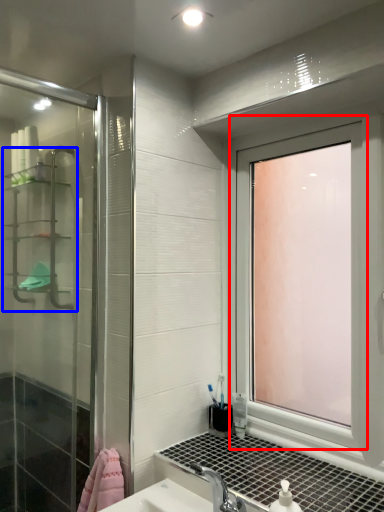
Question: Which object appears farthest to the camera in this image, window (highlighted by a red box) or shelf (highlighted by a blue box)?

Choices:
 (A) window
 (B) shelf

Answer: (B)